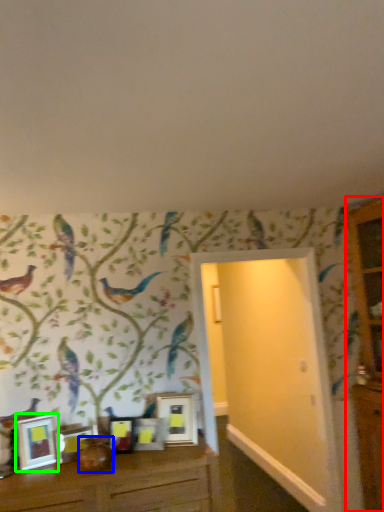
Question: Estimate the real-world distances between objects in this image. Which object is farther from dresser (highlighted by a red box), vase (highlighted by a blue box) or picture frame (highlighted by a green box)?

Choices:
 (A) vase
 (B) picture frame

Answer: (B)